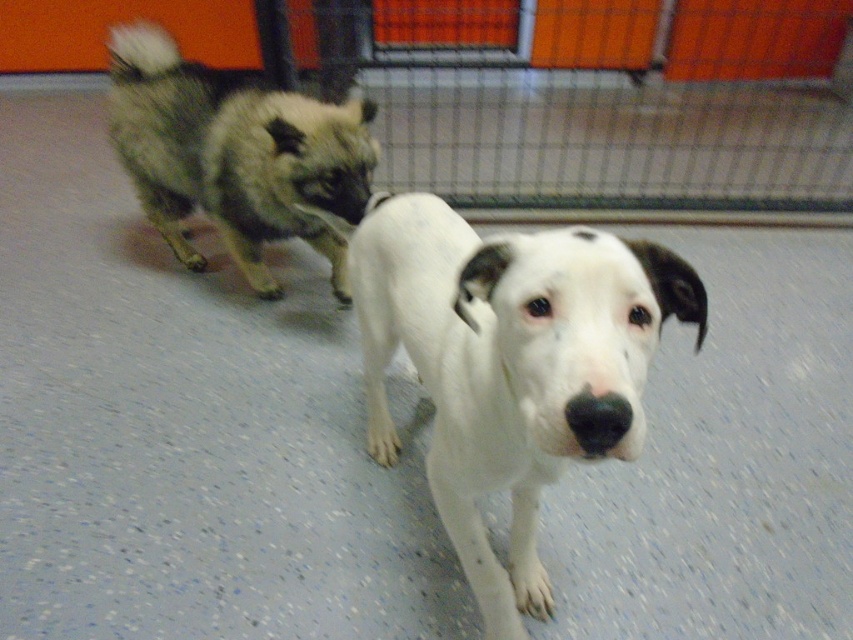
This screenshot has width=853, height=640. In order to click on white smooth dog at center in this screenshot , I will do coord(509,365).

Find the location of a particular element. Image resolution: width=853 pixels, height=640 pixels. white smooth dog at center is located at coordinates click(x=509, y=365).